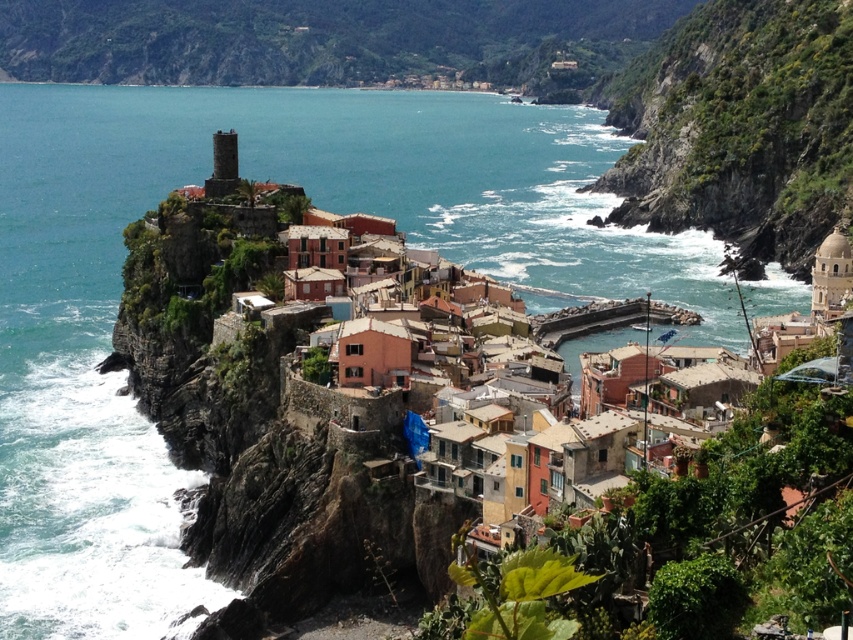
Question: From the image, what is the correct spatial relationship of green leafy hillside at upper center in relation to green mossy rock at center right?

Choices:
 (A) above
 (B) below

Answer: (A)

Question: Which of the following is the closest to the observer?

Choices:
 (A) green mossy rock at center right
 (B) green leafy hillside at upper center

Answer: (A)

Question: Does green leafy hillside at upper center have a larger size compared to green mossy rock at center right?

Choices:
 (A) no
 (B) yes

Answer: (B)

Question: Is green leafy hillside at upper center above green mossy rock at center right?

Choices:
 (A) no
 (B) yes

Answer: (B)

Question: Which of the following is the farthest from the observer?

Choices:
 (A) tap(709, 49)
 (B) tap(650, 26)

Answer: (B)